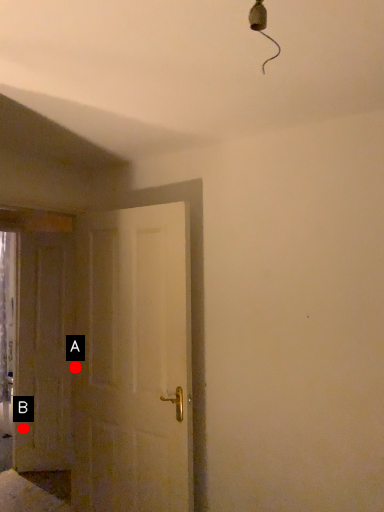
Question: Two points are circled on the image, labeled by A and B beside each circle. Which point appears farthest from the camera in this image?

Choices:
 (A) A is further
 (B) B is further

Answer: (B)